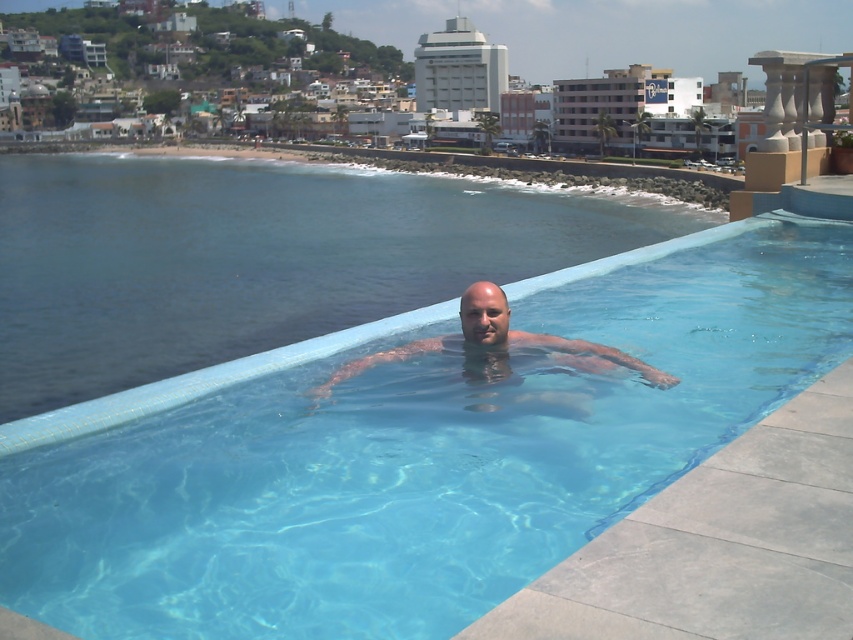
Is the position of clear glass pool at center more distant than that of clear blue water at center?

No, clear glass pool at center is closer to the viewer.

Where is `clear glass pool at center`? The width and height of the screenshot is (853, 640). clear glass pool at center is located at coordinates (409, 454).

Find the location of a particular element. This screenshot has height=640, width=853. clear glass pool at center is located at coordinates (409, 454).

Between point (349, 288) and point (468, 342), which one is positioned in front?

Positioned in front is point (468, 342).

Does point (331, 228) come behind point (543, 346)?

Yes, point (331, 228) is behind point (543, 346).

Between point (666, 218) and point (509, 378), which one is positioned in front?

Point (509, 378) is in front.

Find the location of a particular element. clear blue water at center is located at coordinates (254, 257).

This screenshot has width=853, height=640. What do you see at coordinates (409, 454) in the screenshot?
I see `clear glass pool at center` at bounding box center [409, 454].

Is clear glass pool at center wider than clear skin at center?

Yes.

This screenshot has width=853, height=640. I want to click on clear glass pool at center, so click(x=409, y=454).